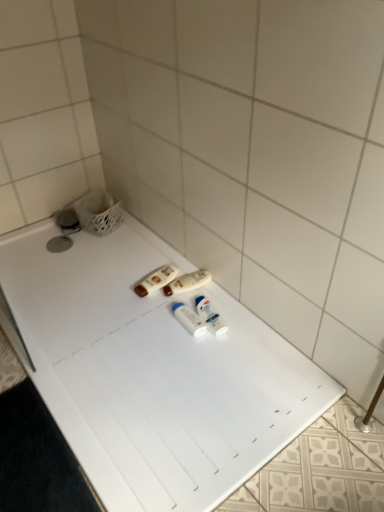
Question: Is point (173, 286) positioned closer to the camera than point (173, 365)?

Choices:
 (A) farther
 (B) closer

Answer: (A)

Question: Considering the positions of white plastic bottles at center, which is the third toiletry in right-to-left order, and white plastic bathtub at center in the image, is white plastic bottles at center, which is the third toiletry in right-to-left order, bigger or smaller than white plastic bathtub at center?

Choices:
 (A) small
 (B) big

Answer: (A)

Question: Which object is the closest to the white plastic bottles at center, the 3th toiletry when ordered from left to right?

Choices:
 (A) white plastic deodorant at center, acting as the first toiletry starting from the right
 (B) white plastic bottles at center, which is the third toiletry in right-to-left order
 (C) brown plastic lotion at center, the first toiletry in the left-to-right sequence
 (D) white plastic bathtub at center

Answer: (A)

Question: Which is farther from the white plastic bottles at center, the second toiletry positioned from the left?

Choices:
 (A) white plastic deodorant at center, marked as the fourth toiletry in a left-to-right arrangement
 (B) white plastic bottles at center, the 3th toiletry when ordered from left to right
 (C) brown plastic lotion at center, positioned as the 4th toiletry in right-to-left order
 (D) white plastic bathtub at center

Answer: (D)